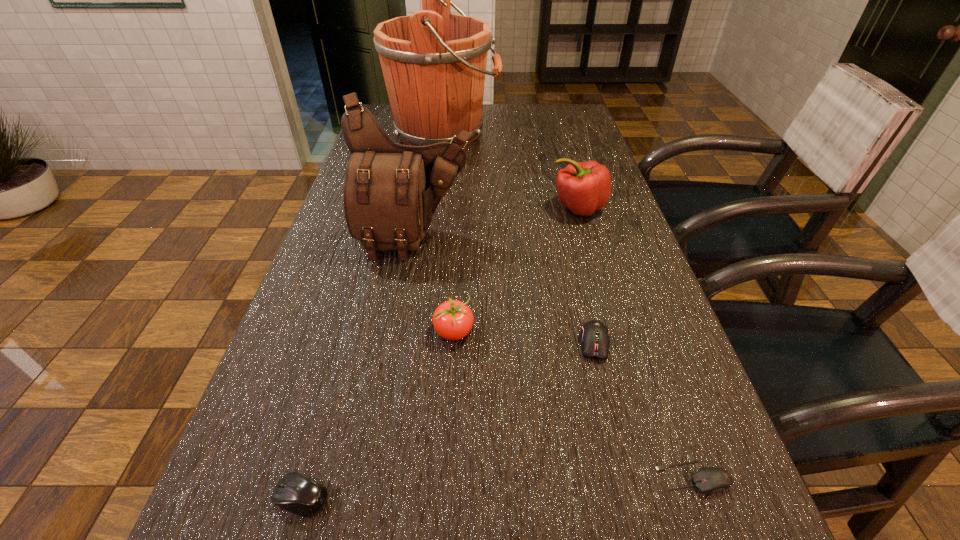
Locate an element on the screen. The height and width of the screenshot is (540, 960). free space located 0.240m on the front-facing side of the sixth shortest object is located at coordinates (396, 345).

The height and width of the screenshot is (540, 960). What are the coordinates of `vacant point located on the left of the bell pepper` in the screenshot? It's located at (453, 207).

Identify the location of free location located 0.220m on the right of the tomato. The height and width of the screenshot is (540, 960). (588, 332).

At what (x,y) coordinates should I click in order to perform the action: click on free space located on the front of the second mouse from left to right. Please return your answer as a coordinate pair (x, y). The image size is (960, 540). Looking at the image, I should click on (610, 406).

At what (x,y) coordinates should I click in order to perform the action: click on free space located 0.140m on the back of the leftmost mouse. Please return your answer as a coordinate pair (x, y). This screenshot has height=540, width=960. Looking at the image, I should click on point(330,395).

The image size is (960, 540). Find the location of `blank space located on the back of the shortest mouse`. blank space located on the back of the shortest mouse is located at coordinates (632, 301).

At what (x,y) coordinates should I click in order to perform the action: click on object at the far edge. Please return your answer as a coordinate pair (x, y). Image resolution: width=960 pixels, height=540 pixels. Looking at the image, I should click on (434, 63).

Where is `bucket located at the left edge`? The width and height of the screenshot is (960, 540). bucket located at the left edge is located at coordinates tap(434, 63).

What are the coordinates of `shoulder bag that is at the left edge` in the screenshot? It's located at (391, 191).

Locate an element on the screen. This screenshot has height=540, width=960. mouse that is positioned at the left edge is located at coordinates (296, 493).